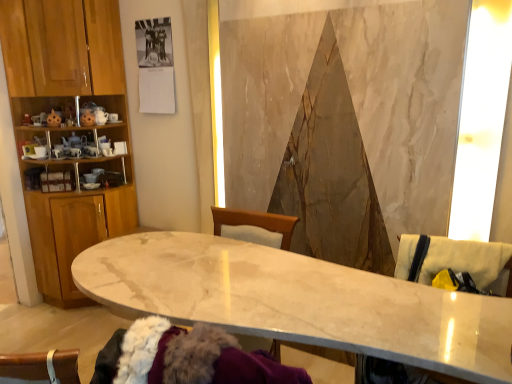
Question: From a real-world perspective, is wooden cabinet at left under beige fabric swivel chair at right, which is the 1th swivel chair from bottom to top?

Choices:
 (A) yes
 (B) no

Answer: (B)

Question: Could you tell me if wooden cabinet at left is facing beige fabric swivel chair at right, which is the 1th swivel chair from bottom to top?

Choices:
 (A) yes
 (B) no

Answer: (A)

Question: Considering the relative positions of wooden cabinet at left and beige fabric swivel chair at right, the second swivel chair in the top-to-bottom sequence, in the image provided, is wooden cabinet at left behind beige fabric swivel chair at right, the second swivel chair in the top-to-bottom sequence,?

Choices:
 (A) yes
 (B) no

Answer: (A)

Question: From a real-world perspective, is wooden cabinet at left on top of beige fabric swivel chair at right, which is the 1th swivel chair from bottom to top?

Choices:
 (A) no
 (B) yes

Answer: (B)

Question: Does wooden cabinet at left appear on the right side of beige fabric swivel chair at right, which is the 1th swivel chair from bottom to top?

Choices:
 (A) no
 (B) yes

Answer: (A)

Question: Is wooden cabinet at left not close to beige fabric swivel chair at right, the second swivel chair in the top-to-bottom sequence?

Choices:
 (A) no
 (B) yes

Answer: (B)

Question: From a real-world perspective, is beige fabric swivel chair at right, the second swivel chair in the top-to-bottom sequence, physically above beige fabric swivel chair at right, which ranks as the first swivel chair in top-to-bottom order?

Choices:
 (A) no
 (B) yes

Answer: (A)

Question: From the image's perspective, does beige fabric swivel chair at right, the second swivel chair in the top-to-bottom sequence, appear lower than beige fabric swivel chair at right, which ranks as the first swivel chair in top-to-bottom order?

Choices:
 (A) yes
 (B) no

Answer: (A)

Question: Is beige fabric swivel chair at right, the second swivel chair in the top-to-bottom sequence, at the left side of beige fabric swivel chair at right, which ranks as the first swivel chair in top-to-bottom order?

Choices:
 (A) yes
 (B) no

Answer: (A)

Question: Can you confirm if beige fabric swivel chair at right, the second swivel chair in the top-to-bottom sequence, is taller than beige fabric swivel chair at right, which ranks as the first swivel chair in top-to-bottom order?

Choices:
 (A) no
 (B) yes

Answer: (B)

Question: Is beige fabric swivel chair at right, the second swivel chair in the top-to-bottom sequence, in front of beige fabric swivel chair at right, the second swivel chair when ordered from bottom to top?

Choices:
 (A) no
 (B) yes

Answer: (B)

Question: Is beige fabric swivel chair at right, which is the 1th swivel chair from bottom to top, thinner than beige fabric swivel chair at right, the second swivel chair when ordered from bottom to top?

Choices:
 (A) no
 (B) yes

Answer: (A)

Question: Does marble table at center have a smaller size compared to wooden cabinet at left?

Choices:
 (A) no
 (B) yes

Answer: (A)